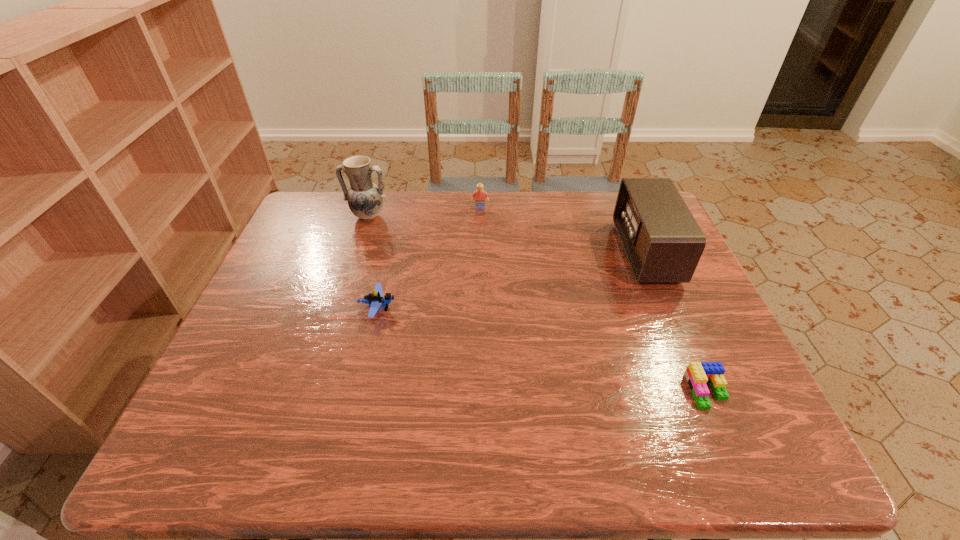
You are a GUI agent. You are given a task and a screenshot of the screen. Output one action in this format:
    pyautogui.click(x=<x>, y=<y>)
    Task: Click on the pottery
    Image resolution: width=960 pixels, height=540 pixels.
    Given the screenshot: What is the action you would take?
    pyautogui.click(x=365, y=199)

This screenshot has width=960, height=540. What are the coordinates of `the second tallest object` in the screenshot? It's located at coord(663,243).

Where is `the farthest Lego`? the farthest Lego is located at coordinates (479, 195).

Find the location of a particular element. The image size is (960, 540). the third object from left to right is located at coordinates (479, 195).

Where is `the second nearest Lego`? The height and width of the screenshot is (540, 960). the second nearest Lego is located at coordinates (375, 300).

This screenshot has height=540, width=960. Find the location of `the fourth tallest object`. the fourth tallest object is located at coordinates (375, 300).

The height and width of the screenshot is (540, 960). I want to click on the nearest Lego, so 697,374.

The image size is (960, 540). I want to click on the shortest object, so click(697, 374).

Find the location of a particular element. free space located on either side of the pottery is located at coordinates (361, 238).

This screenshot has height=540, width=960. Identify the location of vacant space located 0.320m on the front-facing side of the radio receiver. (x=510, y=253).